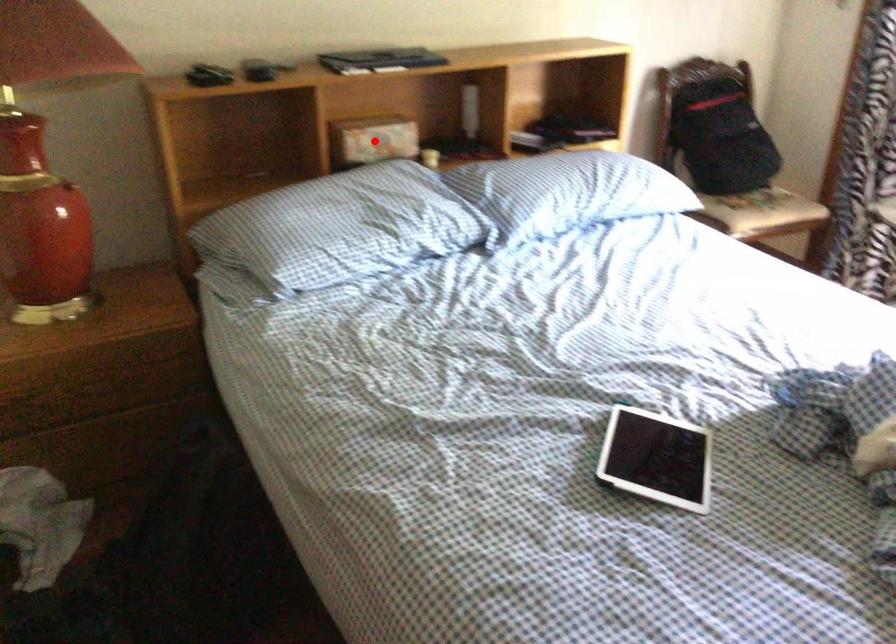
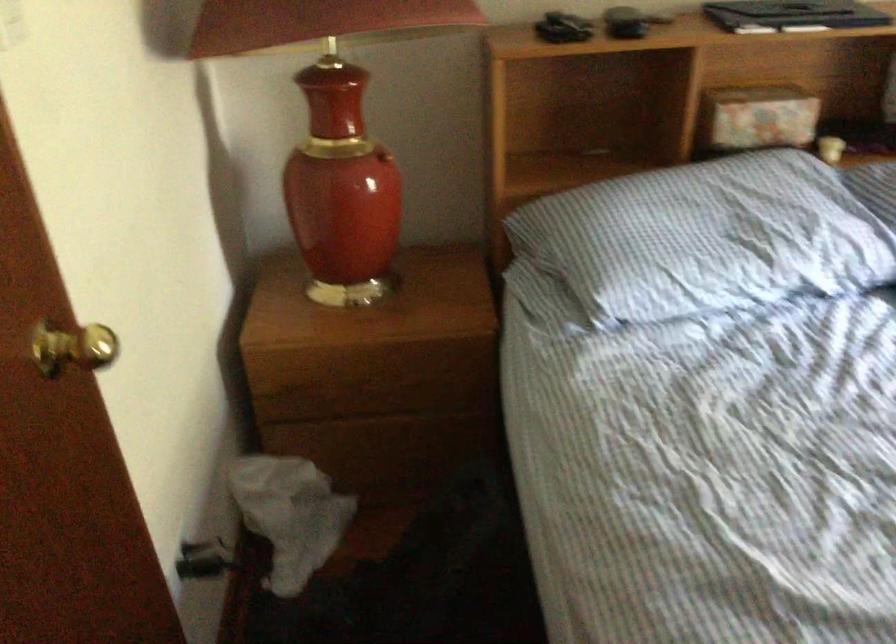
Question: A red point is marked in image1. In image2, is the corresponding 3D point closer to the camera or farther? Reply with the corresponding letter.

Choices:
 (A) The corresponding 3D point is closer.
 (B) The corresponding 3D point is farther.

Answer: (A)